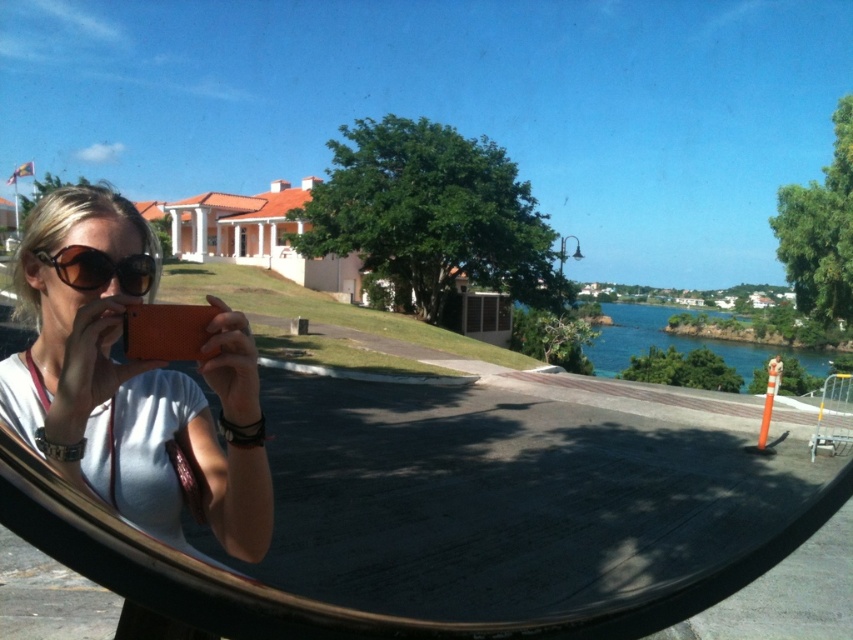
Question: Which object is farther from the camera taking this photo?

Choices:
 (A) matte orange phone at center
 (B) brown matte sunglasses at center

Answer: (B)

Question: Is matte orange phone at center wider than brown matte sunglasses at center?

Choices:
 (A) yes
 (B) no

Answer: (A)

Question: Is matte orange phone at center wider than brown matte sunglasses at center?

Choices:
 (A) no
 (B) yes

Answer: (B)

Question: Does matte orange phone at center appear under brown matte sunglasses at center?

Choices:
 (A) yes
 (B) no

Answer: (A)